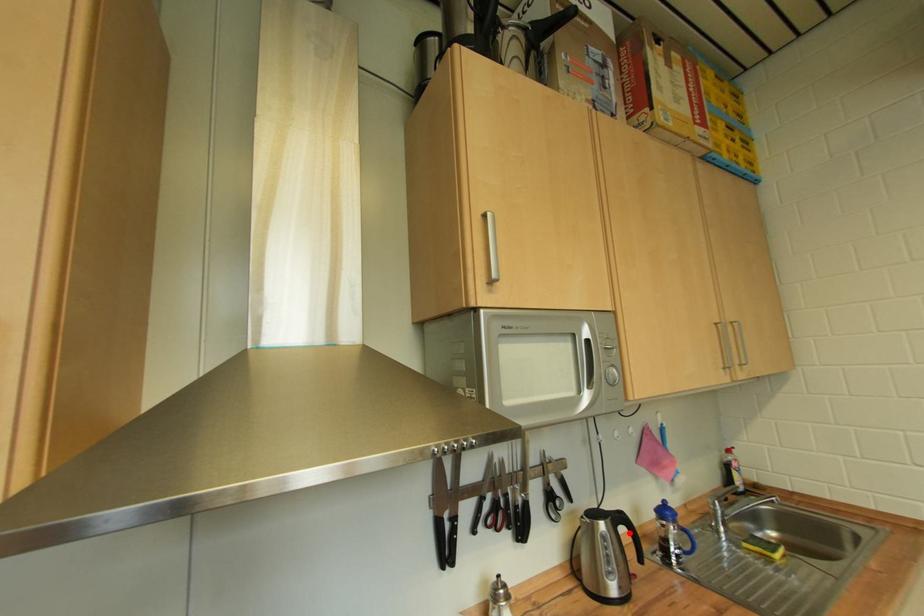
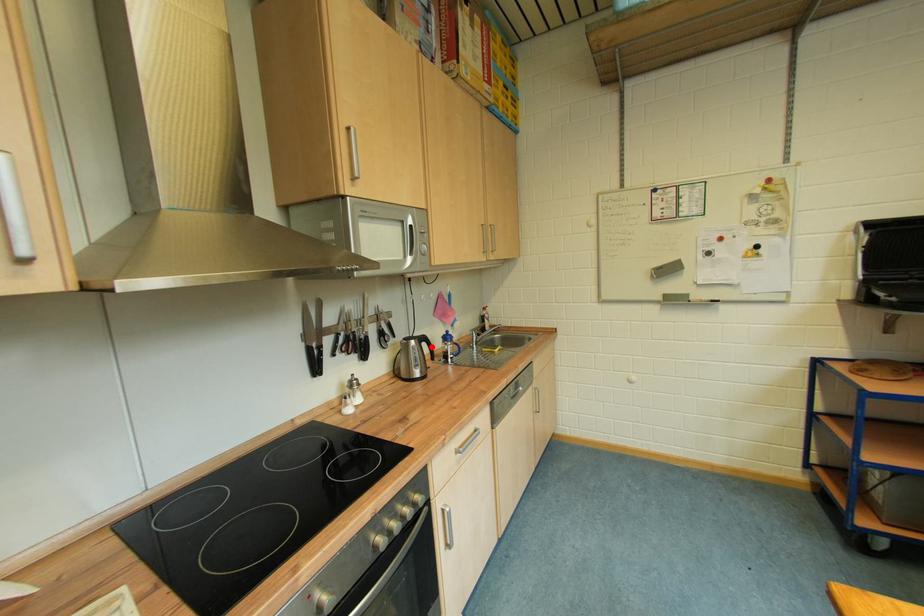
I am providing you with two images of the same scene from different viewpoints. A red point is marked on the first image and another point is marked on the second image. Does the point marked in image1 correspond to the same location as the one in image2?

Yes